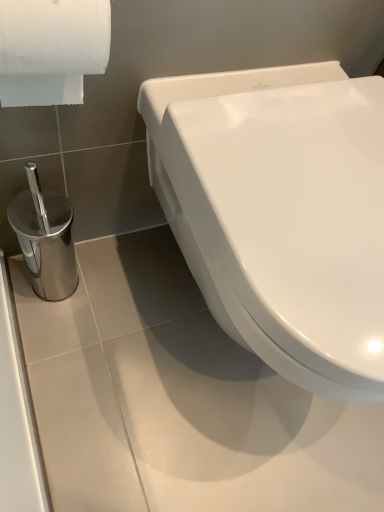
Question: From the image's perspective, is white textured toilet paper at upper left beneath white glossy toilet at center?

Choices:
 (A) no
 (B) yes

Answer: (A)

Question: Considering the relative sizes of white textured toilet paper at upper left and white glossy toilet at center in the image provided, is white textured toilet paper at upper left wider than white glossy toilet at center?

Choices:
 (A) yes
 (B) no

Answer: (B)

Question: Considering the relative sizes of white textured toilet paper at upper left and white glossy toilet at center in the image provided, is white textured toilet paper at upper left taller than white glossy toilet at center?

Choices:
 (A) yes
 (B) no

Answer: (B)

Question: Are white textured toilet paper at upper left and white glossy toilet at center far apart?

Choices:
 (A) yes
 (B) no

Answer: (B)

Question: Is white glossy toilet at center surrounded by white textured toilet paper at upper left?

Choices:
 (A) yes
 (B) no

Answer: (B)

Question: Is white textured toilet paper at upper left at the right side of white glossy toilet at center?

Choices:
 (A) yes
 (B) no

Answer: (B)

Question: Is white textured toilet paper at upper left located within white glossy toilet at center?

Choices:
 (A) yes
 (B) no

Answer: (B)

Question: Is white glossy toilet at center aimed at white textured toilet paper at upper left?

Choices:
 (A) yes
 (B) no

Answer: (B)

Question: Can you confirm if white glossy toilet at center is taller than white textured toilet paper at upper left?

Choices:
 (A) no
 (B) yes

Answer: (B)

Question: Does white glossy toilet at center appear on the right side of white textured toilet paper at upper left?

Choices:
 (A) no
 (B) yes

Answer: (B)

Question: Considering the relative sizes of white glossy toilet at center and white textured toilet paper at upper left in the image provided, is white glossy toilet at center wider than white textured toilet paper at upper left?

Choices:
 (A) yes
 (B) no

Answer: (A)

Question: Is white glossy toilet at center next to white textured toilet paper at upper left and touching it?

Choices:
 (A) no
 (B) yes

Answer: (A)

Question: From a real-world perspective, is white glossy toilet at center physically located above or below white textured toilet paper at upper left?

Choices:
 (A) below
 (B) above

Answer: (A)